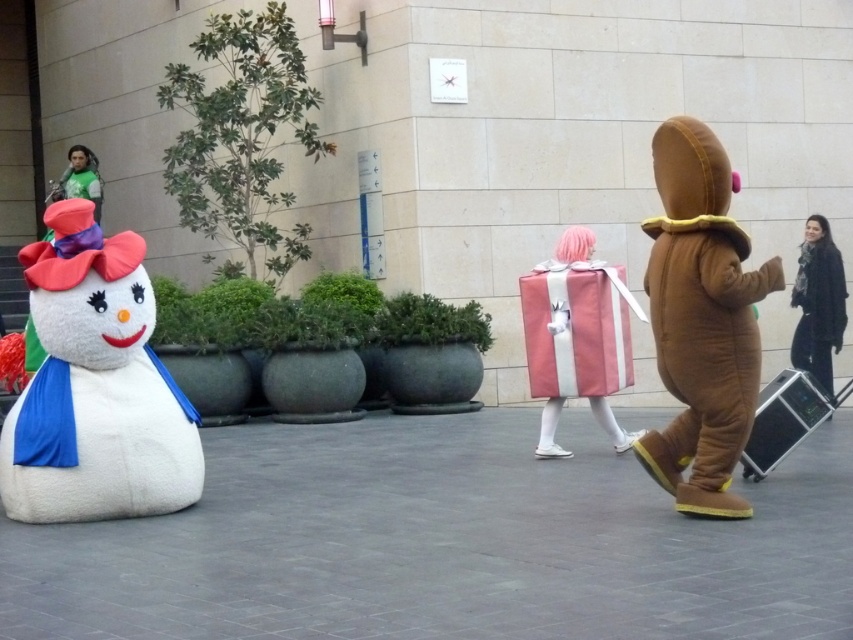
Can you confirm if pink matte gift at center is positioned to the left of dark blue scarf at right?

Indeed, pink matte gift at center is positioned on the left side of dark blue scarf at right.

At what (x,y) coordinates should I click in order to perform the action: click on pink matte gift at center. Please return your answer as a coordinate pair (x, y). Looking at the image, I should click on (577, 337).

Between point (543, 276) and point (828, 262), which one is positioned in front?

Point (543, 276)

In order to click on pink matte gift at center in this screenshot , I will do coord(577,337).

Is brown plush bear at right to the left of pink matte gift at center from the viewer's perspective?

Incorrect, brown plush bear at right is not on the left side of pink matte gift at center.

Is point (698, 412) farther from viewer compared to point (596, 285)?

No, (698, 412) is closer to viewer.

What do you see at coordinates (701, 321) in the screenshot? I see `brown plush bear at right` at bounding box center [701, 321].

Identify the location of brown plush bear at right. The image size is (853, 640). (701, 321).

Is white plush snowman at left above brown plush bear at right?

Actually, white plush snowman at left is below brown plush bear at right.

Can you confirm if white plush snowman at left is thinner than brown plush bear at right?

No, white plush snowman at left is not thinner than brown plush bear at right.

Is point (108, 273) more distant than point (683, 324)?

Yes.

Locate an element on the screen. This screenshot has height=640, width=853. white plush snowman at left is located at coordinates (96, 387).